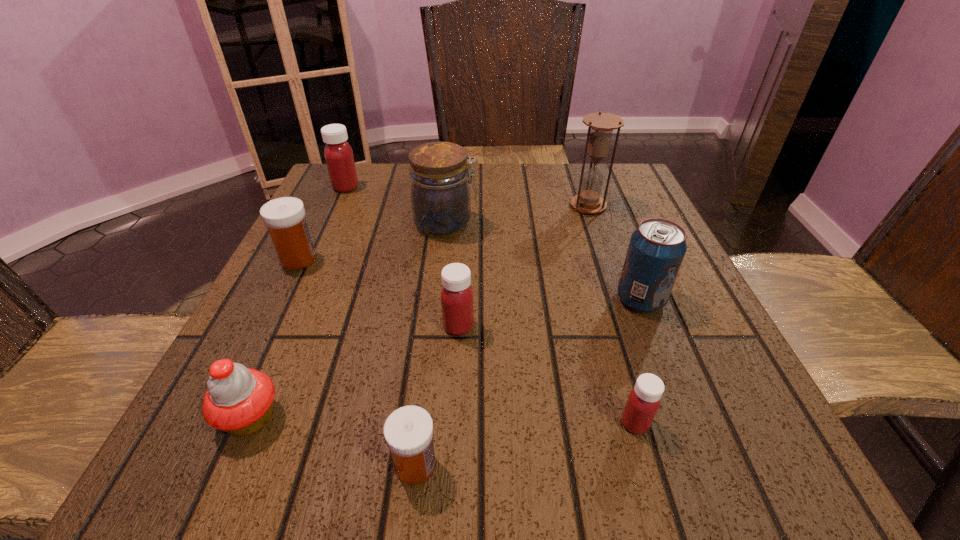
You are a GUI agent. You are given a task and a screenshot of the screen. Output one action in this format:
    pyautogui.click(x=<x>, y=<y>)
    Task: Click on the pop soda present at the right edge
    
    Given the screenshot: What is the action you would take?
    click(656, 250)

Find the location of a particular element. This screenshot has width=960, height=540. object that is at the far left corner is located at coordinates (338, 154).

At what (x,y) coordinates should I click in order to perform the action: click on object that is at the near left corner. Please return your answer as a coordinate pair (x, y). The height and width of the screenshot is (540, 960). Looking at the image, I should click on (239, 400).

This screenshot has height=540, width=960. I want to click on object at the far right corner, so click(x=601, y=125).

The width and height of the screenshot is (960, 540). I want to click on free space at the far edge of the desktop, so click(491, 175).

At what (x,y) coordinates should I click in order to perform the action: click on blank space at the near edge. Please return your answer as a coordinate pair (x, y). The image size is (960, 540). Looking at the image, I should click on (381, 471).

Find the location of `free spot at the left edge of the desktop`. free spot at the left edge of the desktop is located at coordinates tap(336, 255).

In the image, there is a desktop. Where is `free space at the far left corner`? The image size is (960, 540). free space at the far left corner is located at coordinates (376, 165).

This screenshot has height=540, width=960. In the image, there is a desktop. What are the coordinates of `vacant space at the far right corner` in the screenshot? It's located at (610, 187).

I want to click on empty location between the jar and the left white medicine, so click(372, 242).